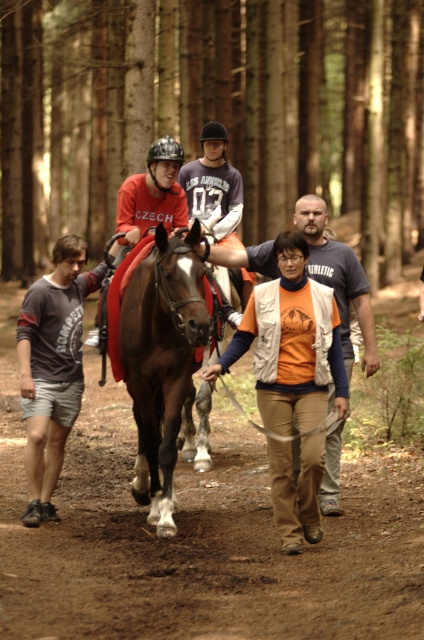
In the scene shown: You are standing at point [212,113] in the forest. What do you see around you?

You see brown wood pine forest at center around you.

You are a hiker planning to take a photo of the brown wood pine forest at center and the brown dirt track at center. Which object should you focus on first if you want both to be in clear focus?

The brown dirt track at center should be focused on first because it is closer to the camera than the brown wood pine forest at center, which is much taller and farther away.